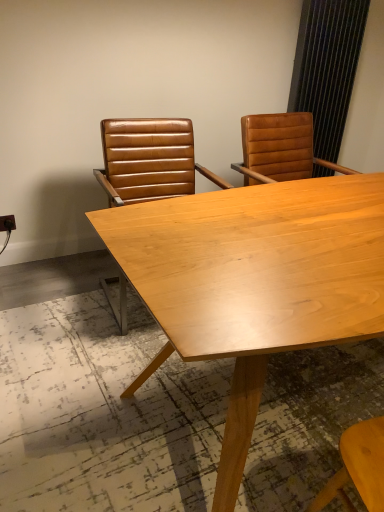
Question: Relative to brown leather chair at center, the 1th chair in the left-to-right sequence, is light wood table at center in front or behind?

Choices:
 (A) behind
 (B) front

Answer: (B)

Question: In the image, is light wood table at center on the left side or the right side of brown leather chair at center, the second chair when ordered from right to left?

Choices:
 (A) left
 (B) right

Answer: (B)

Question: Which object is positioned farthest from the light wood table at center?

Choices:
 (A) brown leather chair at upper right, which appears as the first chair when viewed from the right
 (B) brown leather chair at center, the second chair when ordered from right to left
 (C) black textured curtain at upper right

Answer: (C)

Question: Estimate the real-world distances between objects in this image. Which object is farther from the brown leather chair at upper right, which appears as the first chair when viewed from the right?

Choices:
 (A) black textured curtain at upper right
 (B) light wood table at center
 (C) brown leather chair at center, the 1th chair in the left-to-right sequence

Answer: (B)